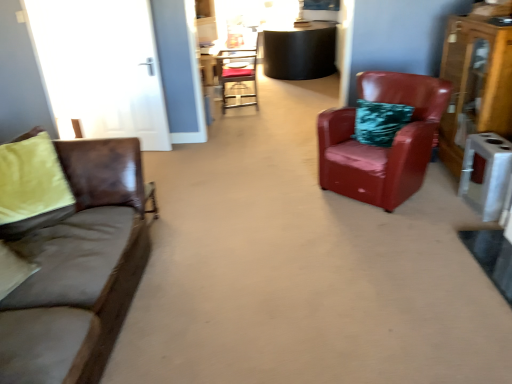
The height and width of the screenshot is (384, 512). Describe the element at coordinates (237, 74) in the screenshot. I see `metallic silver chair at center, acting as the second chair starting from the front` at that location.

In order to face brown leather couch at left, should I rotate leftwards or rightwards?

Turn left by 30.842 degrees to look at brown leather couch at left.

Locate an element on the screen. This screenshot has width=512, height=384. leather armchair at right, which is counted as the first chair, starting from the front is located at coordinates (382, 147).

From the image's perspective, is leather armchair at right, which ranks as the second chair in back-to-front order, under wooden dresser at right?

Indeed, from the image's perspective, leather armchair at right, which ranks as the second chair in back-to-front order, is shown beneath wooden dresser at right.

Is leather armchair at right, positioned as the 1th chair in bottom-to-top order, next to wooden dresser at right and touching it?

leather armchair at right, positioned as the 1th chair in bottom-to-top order, and wooden dresser at right are not in contact.

Would you say wooden dresser at right is part of leather armchair at right, which ranks as the second chair in left-to-right order,'s contents?

That's incorrect, wooden dresser at right is not inside leather armchair at right, which ranks as the second chair in left-to-right order.

Does leather armchair at right, which ranks as the second chair in back-to-front order, have a lesser width compared to wooden dresser at right?

In fact, leather armchair at right, which ranks as the second chair in back-to-front order, might be wider than wooden dresser at right.

Can you tell me how much brown leather couch at left and metallic silver chair at center, arranged as the 1th chair when viewed from the back, differ in facing direction?

brown leather couch at left and metallic silver chair at center, arranged as the 1th chair when viewed from the back, are facing 180 degrees away from each other.

From the picture: Is brown leather couch at left next to metallic silver chair at center, marked as the 1th chair in a top-to-bottom arrangement, and touching it?

No.

From the image's perspective, which one is positioned higher, brown leather couch at left or metallic silver chair at center, the first chair viewed from the left?

metallic silver chair at center, the first chair viewed from the left.

Where is `studio couch below the metallic silver chair at center, acting as the second chair starting from the front (from the image's perspective)`? studio couch below the metallic silver chair at center, acting as the second chair starting from the front (from the image's perspective) is located at coordinates (80, 269).

At what (x,y) coordinates should I click in order to perform the action: click on chair above the leather armchair at right, positioned as the 1th chair in bottom-to-top order (from the image's perspective). Please return your answer as a coordinate pair (x, y). This screenshot has height=384, width=512. Looking at the image, I should click on (237, 74).

In terms of height, does leather armchair at right, which is the 2th chair from top to bottom, look taller or shorter compared to metallic silver chair at center, marked as the 1th chair in a top-to-bottom arrangement?

In the image, leather armchair at right, which is the 2th chair from top to bottom, appears to be shorter than metallic silver chair at center, marked as the 1th chair in a top-to-bottom arrangement.

Considering the positions of objects leather armchair at right, positioned as the 1th chair in bottom-to-top order, and metallic silver chair at center, the 2th chair when ordered from bottom to top, in the image provided, who is more to the right, leather armchair at right, positioned as the 1th chair in bottom-to-top order, or metallic silver chair at center, the 2th chair when ordered from bottom to top,?

Positioned to the right is leather armchair at right, positioned as the 1th chair in bottom-to-top order.

Which is closer to the camera, [356,185] or [232,72]?

The point [356,185] is closer to the camera.

Does wooden dresser at right have a lesser width compared to leather armchair at right, which ranks as the second chair in left-to-right order?

Yes.

Considering the positions of objects wooden dresser at right and leather armchair at right, positioned as the 1th chair in bottom-to-top order, in the image provided, who is behind, wooden dresser at right or leather armchair at right, positioned as the 1th chair in bottom-to-top order,?

wooden dresser at right is behind.

From the image's perspective, which one is positioned lower, wooden dresser at right or leather armchair at right, which is counted as the first chair, starting from the front?

leather armchair at right, which is counted as the first chair, starting from the front, appears lower in the image.

Looking at this image, between leather armchair at right, positioned as the 1th chair in bottom-to-top order, and brown leather couch at left, which one appears on the right side from the viewer's perspective?

leather armchair at right, positioned as the 1th chair in bottom-to-top order.

Is brown leather couch at left at the back of leather armchair at right, which ranks as the second chair in back-to-front order?

That's not correct — leather armchair at right, which ranks as the second chair in back-to-front order, is not looking away from brown leather couch at left.

I want to click on studio couch above the leather armchair at right, which ranks as the second chair in back-to-front order (from a real-world perspective), so click(x=80, y=269).

Between wooden dresser at right and metallic silver chair at center, marked as the 1th chair in a top-to-bottom arrangement, which one has larger size?

With larger size is wooden dresser at right.

The image size is (512, 384). Find the location of `dresser above the metallic silver chair at center, marked as the 1th chair in a top-to-bottom arrangement (from a real-world perspective)`. dresser above the metallic silver chair at center, marked as the 1th chair in a top-to-bottom arrangement (from a real-world perspective) is located at coordinates (475, 84).

Which is more to the right, wooden dresser at right or metallic silver chair at center, the 2th chair when ordered from bottom to top?

wooden dresser at right.

In the image, is brown leather couch at left positioned in front of or behind wooden dresser at right?

brown leather couch at left is in front of wooden dresser at right.

What's the angular difference between brown leather couch at left and wooden dresser at right's facing directions?

178 degrees separate the facing orientations of brown leather couch at left and wooden dresser at right.

Can you confirm if brown leather couch at left is shorter than wooden dresser at right?

Correct, brown leather couch at left is not as tall as wooden dresser at right.

The width and height of the screenshot is (512, 384). I want to click on dresser lying above the leather armchair at right, which ranks as the second chair in left-to-right order (from the image's perspective), so click(475, 84).

Identify the location of the 1st chair counting from the right of the brown leather couch at left. (237, 74).

Considering their positions, is metallic silver chair at center, the first chair viewed from the left, positioned further to brown leather couch at left than wooden dresser at right?

metallic silver chair at center, the first chair viewed from the left.

Considering their positions, is wooden dresser at right positioned closer to brown leather couch at left than metallic silver chair at center, the first chair viewed from the left?

wooden dresser at right lies closer to brown leather couch at left than the other object.

Estimate the real-world distances between objects in this image. Which object is closer to metallic silver chair at center, which appears as the second chair when viewed from the right, leather armchair at right, which is counted as the first chair, starting from the front, or wooden dresser at right?

Among the two, leather armchair at right, which is counted as the first chair, starting from the front, is located nearer to metallic silver chair at center, which appears as the second chair when viewed from the right.

When comparing their distances from leather armchair at right, which is the first chair in right-to-left order, does metallic silver chair at center, which appears as the second chair when viewed from the right, or brown leather couch at left seem closer?

brown leather couch at left.

Estimate the real-world distances between objects in this image. Which object is further from metallic silver chair at center, acting as the second chair starting from the front, wooden dresser at right or leather armchair at right, positioned as the 1th chair in bottom-to-top order?

wooden dresser at right lies further to metallic silver chair at center, acting as the second chair starting from the front, than the other object.

From the image, which object appears to be farther from wooden dresser at right, metallic silver chair at center, arranged as the 1th chair when viewed from the back, or brown leather couch at left?

The object further to wooden dresser at right is metallic silver chair at center, arranged as the 1th chair when viewed from the back.

Looking at the image, which one is located further to leather armchair at right, positioned as the 1th chair in bottom-to-top order, metallic silver chair at center, marked as the 1th chair in a top-to-bottom arrangement, or wooden dresser at right?

metallic silver chair at center, marked as the 1th chair in a top-to-bottom arrangement, is further to leather armchair at right, positioned as the 1th chair in bottom-to-top order.

In the scene shown: From the image, which object appears to be nearer to metallic silver chair at center, marked as the 1th chair in a top-to-bottom arrangement, leather armchair at right, which is the 2th chair from top to bottom, or brown leather couch at left?

leather armchair at right, which is the 2th chair from top to bottom, is closer to metallic silver chair at center, marked as the 1th chair in a top-to-bottom arrangement.

In order to click on dresser positioned between brown leather couch at left and metallic silver chair at center, the 2th chair when ordered from bottom to top, from near to far in this screenshot , I will do `click(475, 84)`.

At what (x,y) coordinates should I click in order to perform the action: click on chair between brown leather couch at left and metallic silver chair at center, marked as the 1th chair in a top-to-bottom arrangement, from front to back. Please return your answer as a coordinate pair (x, y). This screenshot has height=384, width=512. Looking at the image, I should click on (382, 147).

In order to click on dresser between leather armchair at right, which is counted as the first chair, starting from the front, and metallic silver chair at center, the first chair viewed from the left, from front to back in this screenshot , I will do `click(475, 84)`.